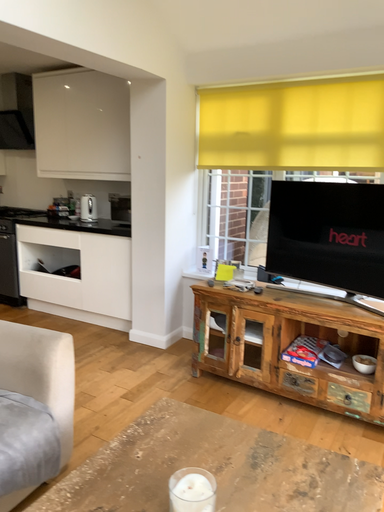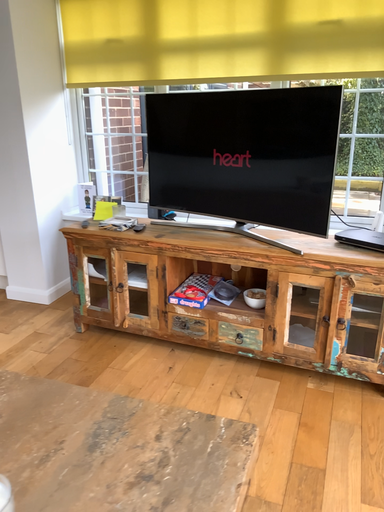
Question: How did the camera likely rotate when shooting the video?

Choices:
 (A) rotated right
 (B) rotated left

Answer: (A)